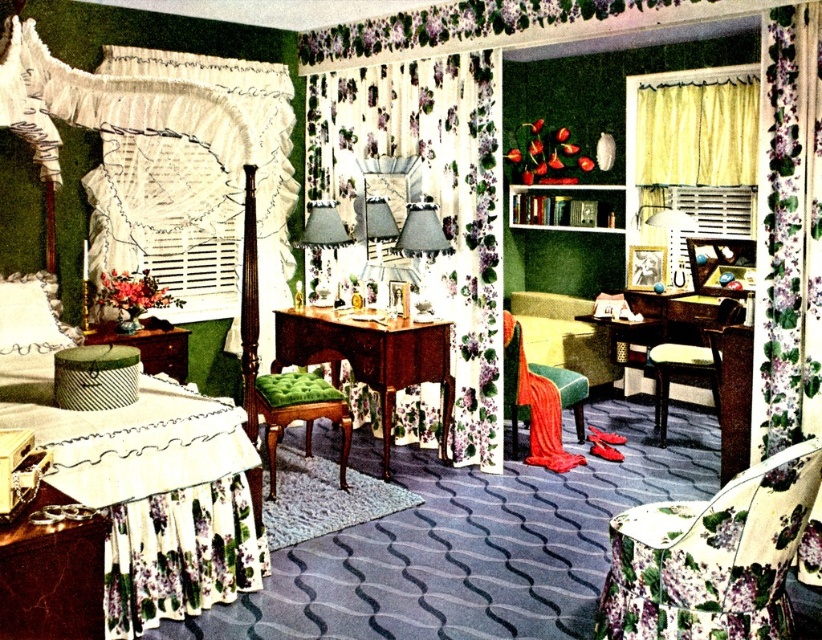
Can you confirm if yellow sheer curtain at upper right is positioned to the right of velvet green armchair at center?

Yes, yellow sheer curtain at upper right is to the right of velvet green armchair at center.

Who is more forward, (717, 154) or (545, 451)?

Point (545, 451) is more forward.

Is point (679, 129) in front of point (543, 449)?

No, (679, 129) is further to viewer.

This screenshot has width=822, height=640. In order to click on yellow sheer curtain at upper right in this screenshot , I will do `click(695, 134)`.

Is velvet green armchair at center positioned at the back of green fabric ottoman at lower left?

Yes, velvet green armchair at center is further from the viewer.

Can you confirm if velvet green armchair at center is smaller than green fabric ottoman at lower left?

No, velvet green armchair at center is not smaller than green fabric ottoman at lower left.

Measure the distance between velvet green armchair at center and camera.

velvet green armchair at center and camera are 4.66 meters apart.

Identify the location of velvet green armchair at center. The image size is (822, 640). (541, 401).

Between floral fabric armchair at lower right and wooden table with green cushion at center, which one appears on the left side from the viewer's perspective?

wooden table with green cushion at center is more to the left.

Which is below, floral fabric armchair at lower right or wooden table with green cushion at center?

Positioned lower is floral fabric armchair at lower right.

Locate an element on the screen. The image size is (822, 640). floral fabric armchair at lower right is located at coordinates (710, 556).

This screenshot has width=822, height=640. What are the coordinates of `floral fabric armchair at lower right` in the screenshot? It's located at (710, 556).